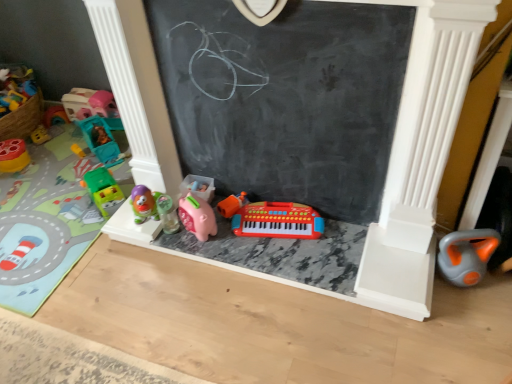
The width and height of the screenshot is (512, 384). In order to click on vacant area on the back side of matte yellow and red toy at left, the 1th toy from the left in this screenshot , I will do `click(41, 141)`.